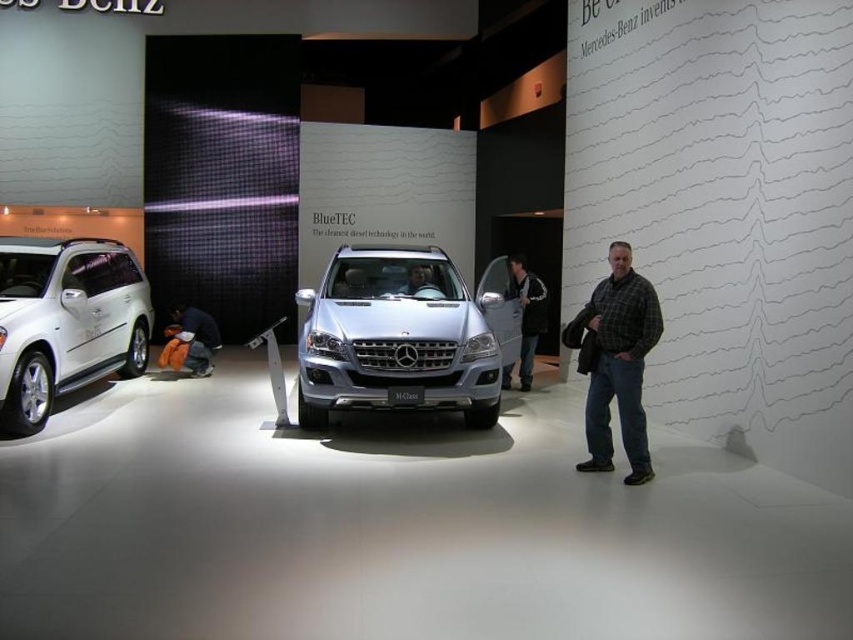
You are a delivery robot with a package that needs to be delivered to the dark gray jacket at center. You are currently positioned near the white matte suv at left. Based on the scene, can you reach the jacket without moving any objects?

The distance between the white matte suv at left and the dark gray jacket at center is 5.33 meters. Since there are no obstacles mentioned in the scene description, the delivery robot can move directly towards the jacket and deliver the package.

You are a customer at the Mercedes showroom and want to see the interior of the satin silver suv at center and the dark gray jacket at center. Which one is closer to the entrance?

The satin silver suv at center is to the left of dark gray jacket at center, but the description does not provide information about their distance from the entrance, so it cannot be determined which is closer.